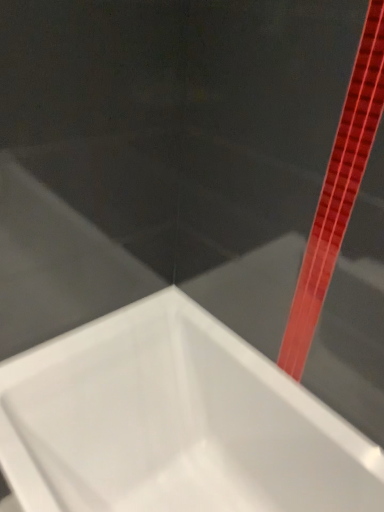
Measure the distance between point [179,315] and camera.

The depth of point [179,315] is 4.57 feet.

What do you see at coordinates (173, 422) in the screenshot? I see `white glossy bathtub at lower left` at bounding box center [173, 422].

Where is `white glossy bathtub at lower left`? white glossy bathtub at lower left is located at coordinates (173, 422).

Locate an element on the screen. This screenshot has width=384, height=512. white glossy bathtub at lower left is located at coordinates (173, 422).